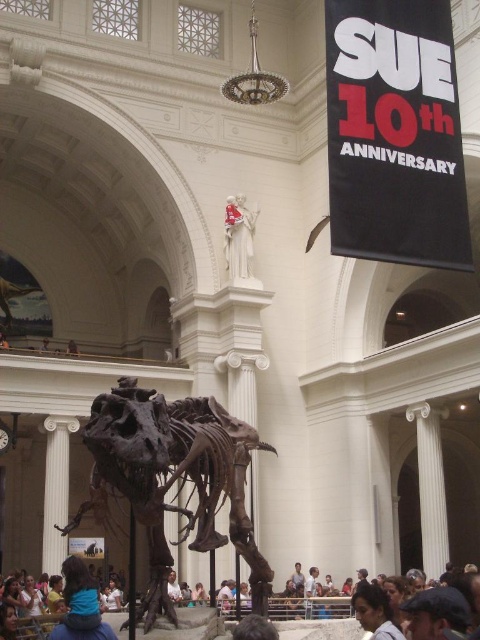
Who is lower down, matte brown hair at lower center or white marble statue at upper center?

matte brown hair at lower center is below.

Who is higher up, matte brown hair at lower center or white marble statue at upper center?

white marble statue at upper center is above.

Image resolution: width=480 pixels, height=640 pixels. Find the location of `matte brown hair at lower center`. matte brown hair at lower center is located at coordinates (309, 608).

Image resolution: width=480 pixels, height=640 pixels. Identify the location of matte brown hair at lower center. (309, 608).

The height and width of the screenshot is (640, 480). Identify the location of blue fabric at lower left. (81, 605).

Between point (67, 595) and point (248, 244), which one is positioned behind?

The point (248, 244) is more distant.

Locate an element on the screen. The height and width of the screenshot is (640, 480). blue fabric at lower left is located at coordinates (81, 605).

Does matte brown hair at lower center have a larger size compared to blue fabric at lower left?

Indeed, matte brown hair at lower center has a larger size compared to blue fabric at lower left.

In the scene shown: Who is shorter, matte brown hair at lower center or blue fabric at lower left?

With less height is blue fabric at lower left.

What do you see at coordinates (309, 608) in the screenshot? Image resolution: width=480 pixels, height=640 pixels. I see `matte brown hair at lower center` at bounding box center [309, 608].

Image resolution: width=480 pixels, height=640 pixels. In order to click on matte brown hair at lower center in this screenshot , I will do `click(309, 608)`.